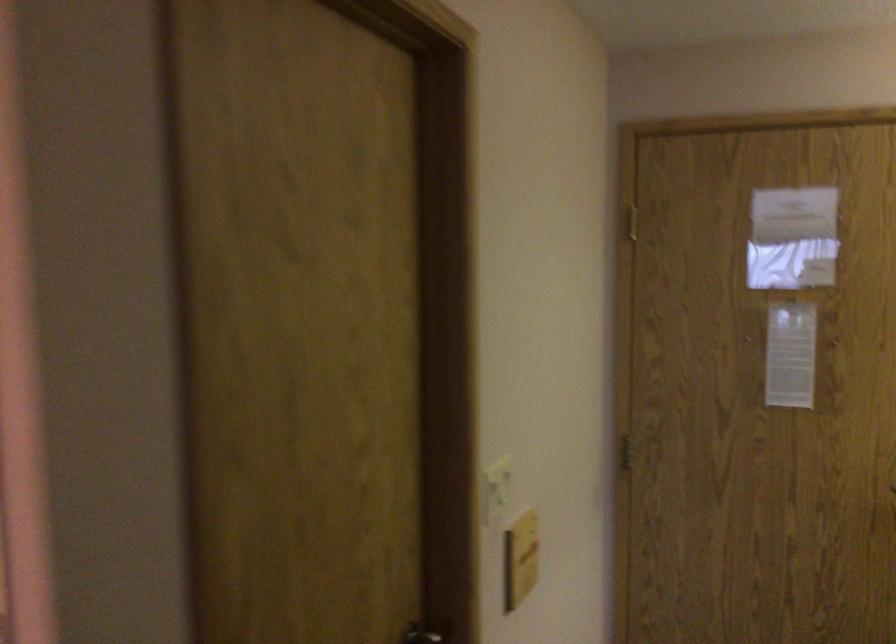
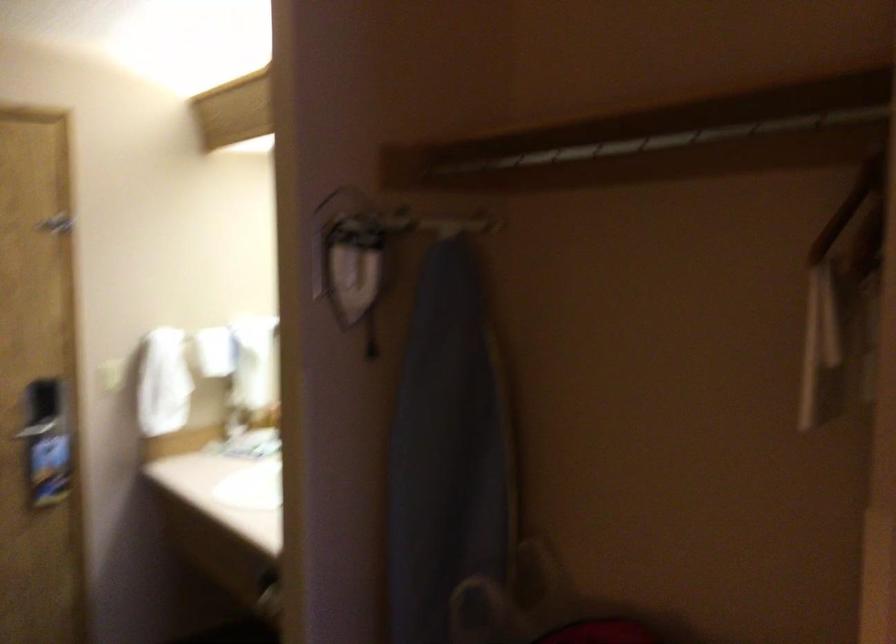
Question: How did the camera likely rotate?

Choices:
 (A) Left
 (B) Right
 (C) Up
 (D) Down

Answer: (B)